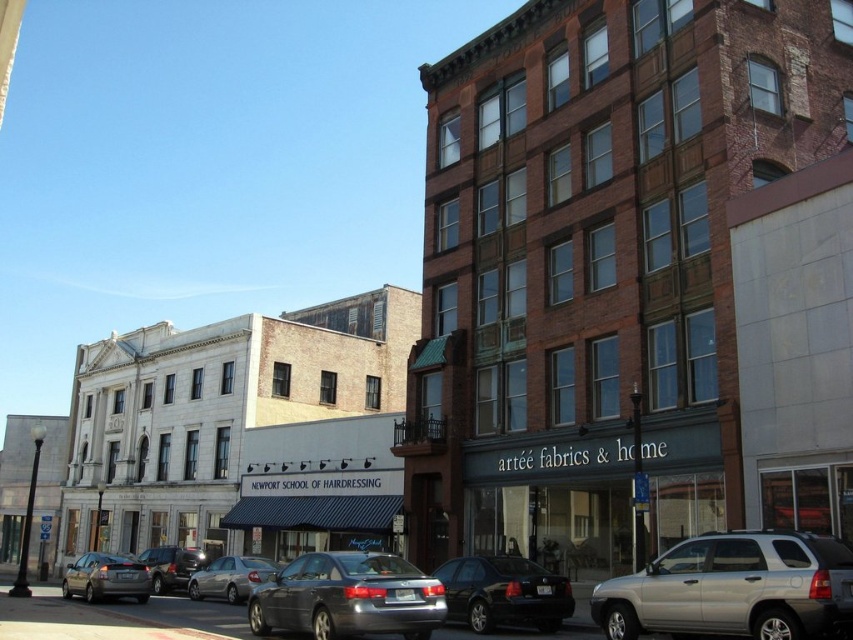
Is satin silver sedan at center bigger than shiny black sedan at center?

Correct, satin silver sedan at center is larger in size than shiny black sedan at center.

Does satin silver sedan at center have a lesser height compared to shiny black sedan at center?

→ No.

Does point (283, 598) lie in front of point (488, 561)?

Yes, point (283, 598) is in front of point (488, 561).

At what (x,y) coordinates should I click in order to perform the action: click on satin silver sedan at center. Please return your answer as a coordinate pair (x, y). Looking at the image, I should click on (347, 596).

Can you confirm if shiny black sedan at center is positioned to the left of shiny silver sedan at lower left?

No, shiny black sedan at center is not to the left of shiny silver sedan at lower left.

Is shiny black sedan at center behind shiny silver sedan at lower left?

No.

The image size is (853, 640). What are the coordinates of `shiny black sedan at center` in the screenshot? It's located at (503, 593).

This screenshot has height=640, width=853. What are the coordinates of `shiny black sedan at center` in the screenshot? It's located at coord(503,593).

Consider the image. Who is positioned more to the left, matte gray sedan at lower left or silver metallic sedan at center?

From the viewer's perspective, matte gray sedan at lower left appears more on the left side.

Find the location of a particular element. This screenshot has height=640, width=853. matte gray sedan at lower left is located at coordinates (106, 577).